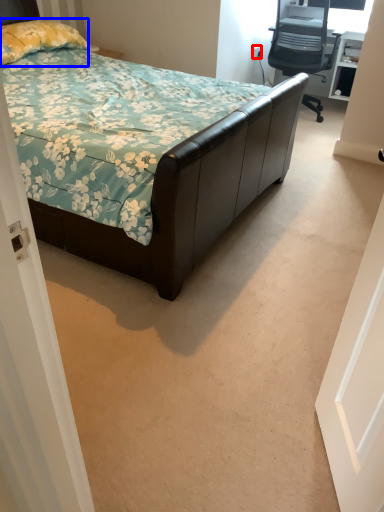
Question: Which of the following is the closest to the observer, power outlet (highlighted by a red box) or pillow (highlighted by a blue box)?

Choices:
 (A) power outlet
 (B) pillow

Answer: (B)